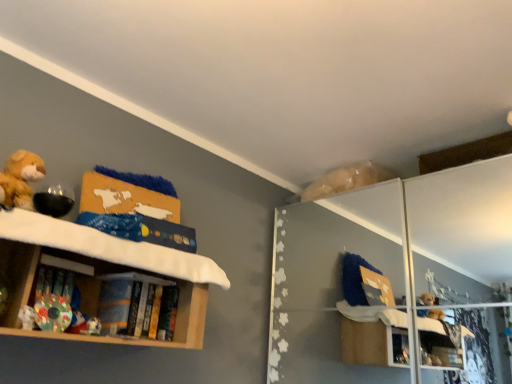
Identify the location of multicolored fabric book at lower left, which is the 2th book from right to left. (57, 301).

This screenshot has height=384, width=512. What do you see at coordinates (127, 264) in the screenshot?
I see `wooden bookshelf at left` at bounding box center [127, 264].

In order to face transparent glass door at upper right, should I rotate leftwards or rightwards?

Rotate right and turn 19.383 degrees.

The width and height of the screenshot is (512, 384). Describe the element at coordinates (383, 258) in the screenshot. I see `transparent glass door at upper right` at that location.

Where is `multicolored fabric book at lower left, marked as the first book in a front-to-back arrangement`? multicolored fabric book at lower left, marked as the first book in a front-to-back arrangement is located at coordinates (57, 301).

Identify the location of the 1st book above the white plush toy at lower left (from a real-world perspective). (57, 301).

Consider the image. From a real-world perspective, is multicolored fabric book at lower left, placed as the 2th book when sorted from back to front, on white plush toy at lower left?

Correct, in the physical world, multicolored fabric book at lower left, placed as the 2th book when sorted from back to front, is higher than white plush toy at lower left.

Is multicolored fabric book at lower left, which is the 2th book from right to left, wider or thinner than white plush toy at lower left?

Considering their sizes, multicolored fabric book at lower left, which is the 2th book from right to left, looks slimmer than white plush toy at lower left.

Which is correct: multicolored fabric book at lower left, marked as the first book in a front-to-back arrangement, is inside white plush toy at lower left, or outside of it?

multicolored fabric book at lower left, marked as the first book in a front-to-back arrangement, lies outside white plush toy at lower left.

Can you confirm if wooden bookshelf at left is positioned to the left of white plush toy at lower left?

No.

Relative to white plush toy at lower left, is wooden bookshelf at left in front or behind?

wooden bookshelf at left is in front of white plush toy at lower left.

Is wooden bookshelf at left not near white plush toy at lower left?

Actually, wooden bookshelf at left and white plush toy at lower left are a little close together.

From a real-world perspective, is wooden bookshelf at left on white plush toy at lower left?

Yes.

Between point (26, 320) and point (41, 316), which one is positioned behind?

The point (41, 316) is farther.

Visually, is white plush toy at lower left positioned to the left or to the right of multicolored fabric book at lower left, placed as the 2th book when sorted from back to front?

In the image, white plush toy at lower left appears on the left side of multicolored fabric book at lower left, placed as the 2th book when sorted from back to front.

From the picture: From the image's perspective, which one is positioned higher, white plush toy at lower left or multicolored fabric book at lower left, the 1th book in the left-to-right sequence?

white plush toy at lower left is shown above in the image.

The image size is (512, 384). I want to click on book that is the 1st object above the white plush toy at lower left (from a real-world perspective), so click(57, 301).

From a real-world perspective, is multicolored fabric book at lower left, which is the 2th book from right to left, under wooden bookshelf at left?

Correct, in the physical world, multicolored fabric book at lower left, which is the 2th book from right to left, is lower than wooden bookshelf at left.

Is multicolored fabric book at lower left, marked as the first book in a front-to-back arrangement, aimed at wooden bookshelf at left?

Yes, multicolored fabric book at lower left, marked as the first book in a front-to-back arrangement, is oriented towards wooden bookshelf at left.

Which object is wider, multicolored fabric book at lower left, which is the 2th book from right to left, or wooden bookshelf at left?

Wider between the two is wooden bookshelf at left.

Who is shorter, multicolored fabric book at lower left, marked as the first book in a front-to-back arrangement, or wooden bookshelf at left?

multicolored fabric book at lower left, marked as the first book in a front-to-back arrangement, is shorter.

From a real-world perspective, between transparent glass door at upper right and multicolored fabric book at lower left, marked as the first book in a front-to-back arrangement, who is vertically lower?

multicolored fabric book at lower left, marked as the first book in a front-to-back arrangement, is physically lower.

Is transparent glass door at upper right taller than multicolored fabric book at lower left, the 1th book in the left-to-right sequence?

Yes.

Is transparent glass door at upper right aimed at multicolored fabric book at lower left, placed as the 2th book when sorted from back to front?

Yes, transparent glass door at upper right is facing multicolored fabric book at lower left, placed as the 2th book when sorted from back to front.

From the image's perspective, would you say transparent glass door at upper right is positioned over multicolored fabric book at lower left, marked as the first book in a front-to-back arrangement?

No, from the image's perspective, transparent glass door at upper right is not above multicolored fabric book at lower left, marked as the first book in a front-to-back arrangement.

Looking at their sizes, would you say wooden bookshelf at left is wider or thinner than transparent glass door at upper right?

Clearly, wooden bookshelf at left has less width compared to transparent glass door at upper right.

Can you tell me how much wooden bookshelf at left and transparent glass door at upper right differ in facing direction?

The angular difference between wooden bookshelf at left and transparent glass door at upper right is 90.3 degrees.

You are a GUI agent. You are given a task and a screenshot of the screen. Output one action in this format:
    pyautogui.click(x=<x>, y=<y>)
    Task: Click on the glass door below the wooden bookshelf at left (from the image's perspective)
    The image size is (512, 384).
    Given the screenshot: What is the action you would take?
    pyautogui.click(x=383, y=258)

In the image, is wooden bookshelf at left on the left side or the right side of transparent glass door at upper right?

Based on their positions, wooden bookshelf at left is located to the left of transparent glass door at upper right.

From a real-world perspective, between wooden bookshelf at left and hardcover book at center, the first book positioned from the right, who is vertically higher?

From a 3D spatial view, wooden bookshelf at left is above.

Choose the correct answer: Is wooden bookshelf at left inside hardcover book at center, which is counted as the 2th book, starting from the front, or outside it?

wooden bookshelf at left is outside hardcover book at center, which is counted as the 2th book, starting from the front.

How far apart are wooden bookshelf at left and hardcover book at center, which is the 1th book in back-to-front order?

They are 6.01 inches apart.

Who is taller, wooden bookshelf at left or hardcover book at center, arranged as the 2th book when viewed from the left?

With more height is wooden bookshelf at left.

From the white plush toy at lower left, count 1st book to the right and point to it. Please provide its 2D coordinates.

[(57, 301)]

Locate an element on the screen. shelf in front of the white plush toy at lower left is located at coordinates (127, 264).

Looking at the image, which one is located closer to hardcover book at center, which is counted as the 2th book, starting from the front, wooden bookshelf at left or transparent glass door at upper right?

Based on the image, wooden bookshelf at left appears to be nearer to hardcover book at center, which is counted as the 2th book, starting from the front.

Looking at the image, which one is located further to white plush toy at lower left, hardcover book at center, the first book positioned from the right, or multicolored fabric book at lower left, placed as the 2th book when sorted from back to front?

Among the two, hardcover book at center, the first book positioned from the right, is located further to white plush toy at lower left.

Looking at the image, which one is located further to multicolored fabric book at lower left, placed as the 2th book when sorted from back to front, transparent glass door at upper right or hardcover book at center, arranged as the 2th book when viewed from the left?

transparent glass door at upper right is positioned further to the anchor multicolored fabric book at lower left, placed as the 2th book when sorted from back to front.

Looking at the image, which one is located closer to multicolored fabric book at lower left, the 1th book in the left-to-right sequence, wooden bookshelf at left or transparent glass door at upper right?

wooden bookshelf at left lies closer to multicolored fabric book at lower left, the 1th book in the left-to-right sequence, than the other object.

Based on their spatial positions, is wooden bookshelf at left or multicolored fabric book at lower left, placed as the 2th book when sorted from back to front, closer to transparent glass door at upper right?

wooden bookshelf at left.

Estimate the real-world distances between objects in this image. Which object is closer to transparent glass door at upper right, wooden bookshelf at left or hardcover book at center, which is counted as the 2th book, starting from the front?

Among the two, hardcover book at center, which is counted as the 2th book, starting from the front, is located nearer to transparent glass door at upper right.

Considering their positions, is multicolored fabric book at lower left, placed as the 2th book when sorted from back to front, positioned further to transparent glass door at upper right than hardcover book at center, arranged as the 2th book when viewed from the left?

multicolored fabric book at lower left, placed as the 2th book when sorted from back to front, lies further to transparent glass door at upper right than the other object.

Considering their positions, is hardcover book at center, the first book positioned from the right, positioned closer to multicolored fabric book at lower left, the 1th book in the left-to-right sequence, than white plush toy at lower left?

The object closer to multicolored fabric book at lower left, the 1th book in the left-to-right sequence, is white plush toy at lower left.

Identify the location of toy positioned between wooden bookshelf at left and hardcover book at center, arranged as the 2th book when viewed from the left, from near to far. (27, 317).

This screenshot has height=384, width=512. What are the coordinates of `shelf between multicolored fabric book at lower left, placed as the 2th book when sorted from back to front, and transparent glass door at upper right, in the horizontal direction` in the screenshot? It's located at (127, 264).

Identify the location of toy between wooden bookshelf at left and multicolored fabric book at lower left, marked as the first book in a front-to-back arrangement, from front to back. (27, 317).

Identify the location of book between wooden bookshelf at left and hardcover book at center, arranged as the 2th book when viewed from the left, from front to back. The height and width of the screenshot is (384, 512). (57, 301).